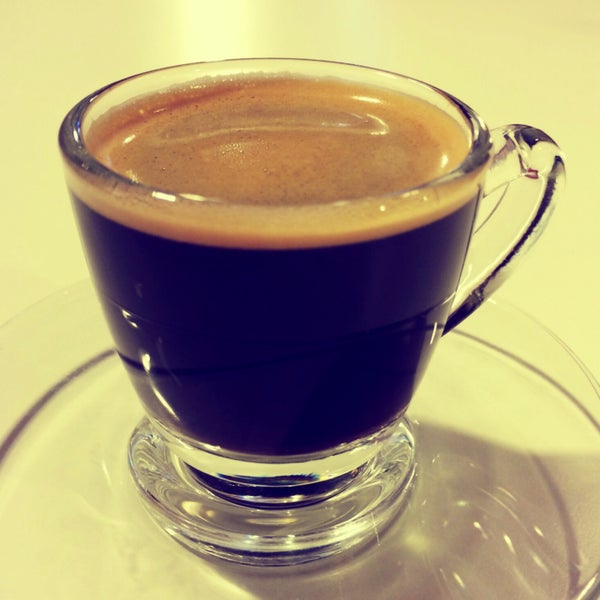
This screenshot has width=600, height=600. What are the coordinates of `light` in the screenshot? It's located at (208, 30).